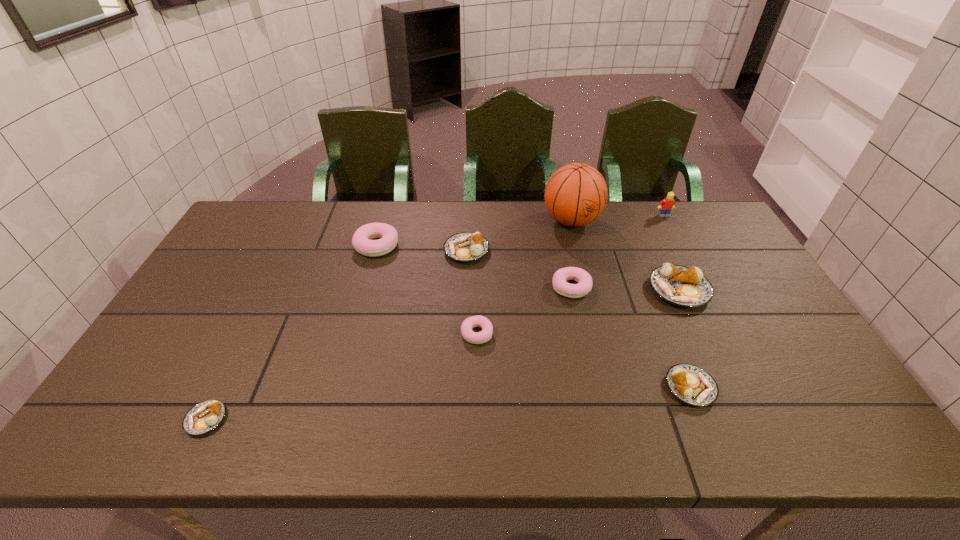
I want to click on free location located on the right of the second brown pastry from left to right, so click(x=508, y=251).

Identify the location of vacant region located on the left of the third pastry from right to left. This screenshot has height=540, width=960. (492, 287).

At what (x,y) coordinates should I click in order to perform the action: click on vacant space located 0.340m on the left of the second smallest brown pastry. Please return your answer as a coordinate pair (x, y). The width and height of the screenshot is (960, 540). Looking at the image, I should click on (525, 388).

Identify the location of vacant space situated 0.130m on the front of the fifth farthest pastry. Image resolution: width=960 pixels, height=540 pixels. (476, 389).

Find the location of a particular element. free location located 0.180m on the right of the leftmost pastry is located at coordinates (304, 419).

Identify the location of basketball located at the far edge. (576, 194).

The image size is (960, 540). In order to click on Lego present at the far edge in this screenshot , I will do `click(667, 204)`.

Where is `object located at the right edge`? Image resolution: width=960 pixels, height=540 pixels. object located at the right edge is located at coordinates click(x=667, y=204).

Image resolution: width=960 pixels, height=540 pixels. I want to click on object that is positioned at the far right corner, so click(667, 204).

This screenshot has width=960, height=540. I want to click on vacant space at the far edge, so click(650, 227).